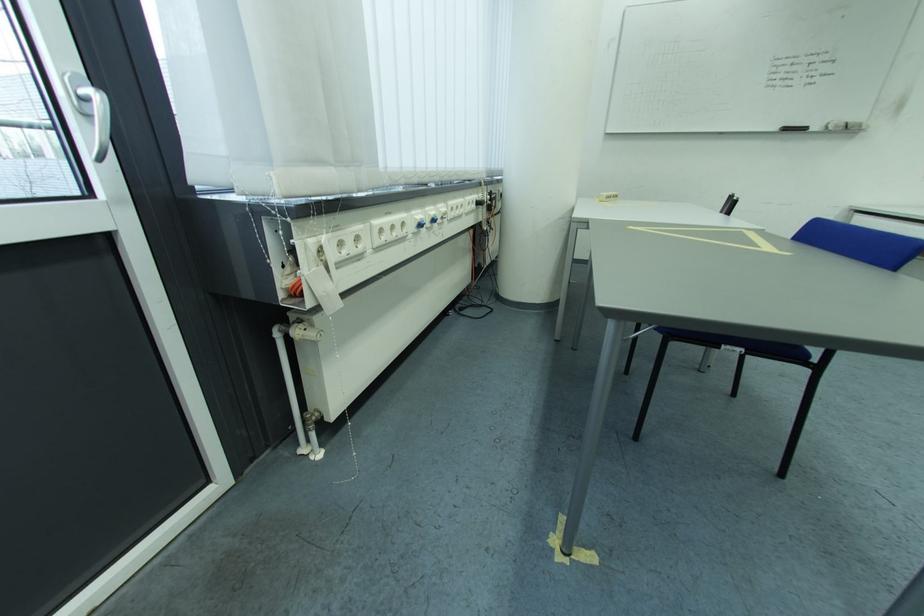
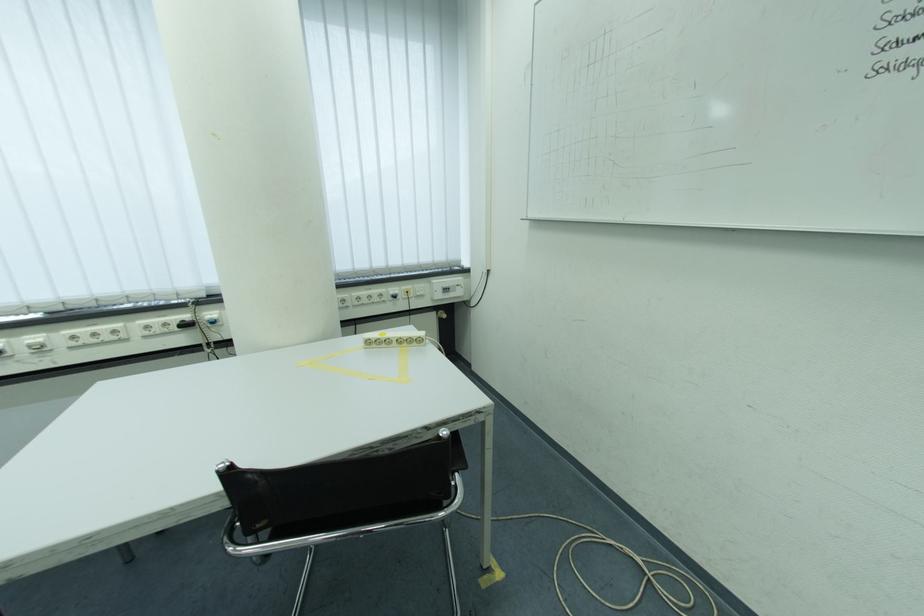
Find the pixel in the second image that matches point 454,212 in the first image.

(50, 342)